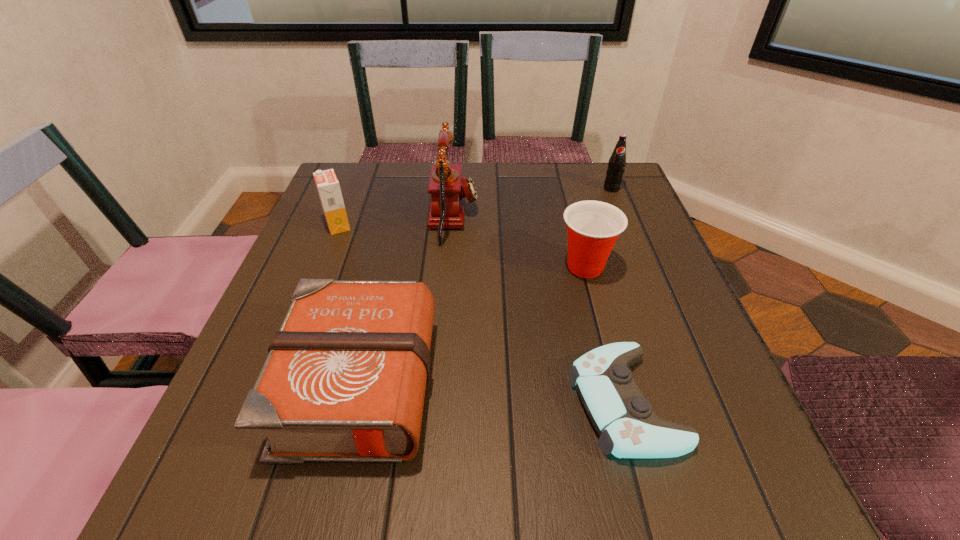
This screenshot has width=960, height=540. I want to click on control at the right edge, so [x=628, y=428].

This screenshot has height=540, width=960. Identify the location of object that is at the near left corner. (344, 380).

Identify the location of object at the far right corner. The height and width of the screenshot is (540, 960). (616, 166).

This screenshot has height=540, width=960. I want to click on object situated at the near right corner, so click(x=628, y=428).

The image size is (960, 540). Find the location of `blank space at the far edge of the desktop`. blank space at the far edge of the desktop is located at coordinates (500, 168).

At what (x,y) coordinates should I click in order to perform the action: click on vacant point at the near edge. Please return your answer as a coordinate pair (x, y). This screenshot has height=540, width=960. Looking at the image, I should click on (403, 516).

Image resolution: width=960 pixels, height=540 pixels. Identify the location of free space at the left edge of the desktop. (346, 281).

In the image, there is a desktop. Where is `vacant space at the right edge`? Image resolution: width=960 pixels, height=540 pixels. vacant space at the right edge is located at coordinates (649, 259).

In the image, there is a desktop. Identify the location of vacant space at the far left corner. point(345,203).

Where is `free spot at the near left corner of the desktop`? The width and height of the screenshot is (960, 540). free spot at the near left corner of the desktop is located at coordinates (203, 481).